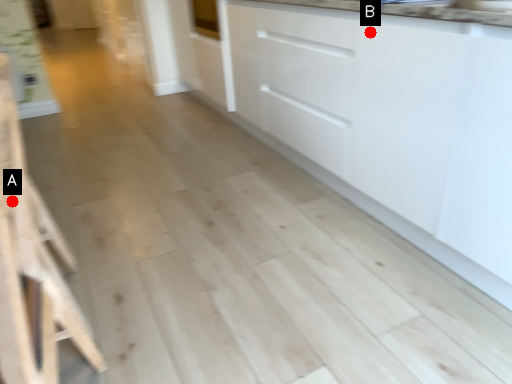
Question: Two points are circled on the image, labeled by A and B beside each circle. Which point appears farthest from the camera in this image?

Choices:
 (A) A is further
 (B) B is further

Answer: (B)